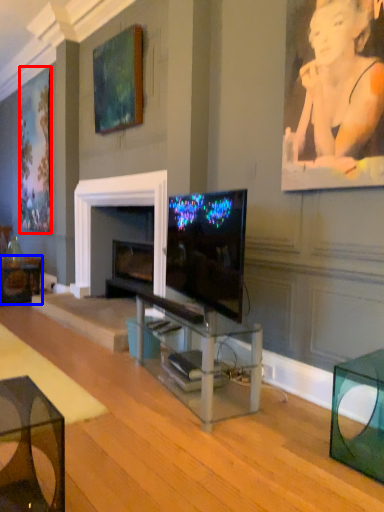
Question: Which point is further to the camera, picture frame (highlighted by a red box) or table (highlighted by a blue box)?

Choices:
 (A) picture frame
 (B) table

Answer: (A)